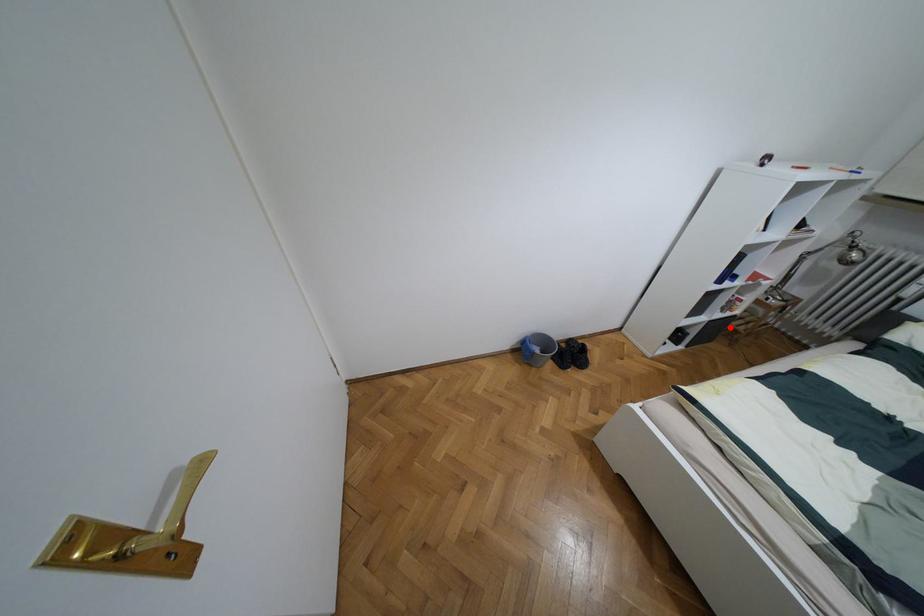
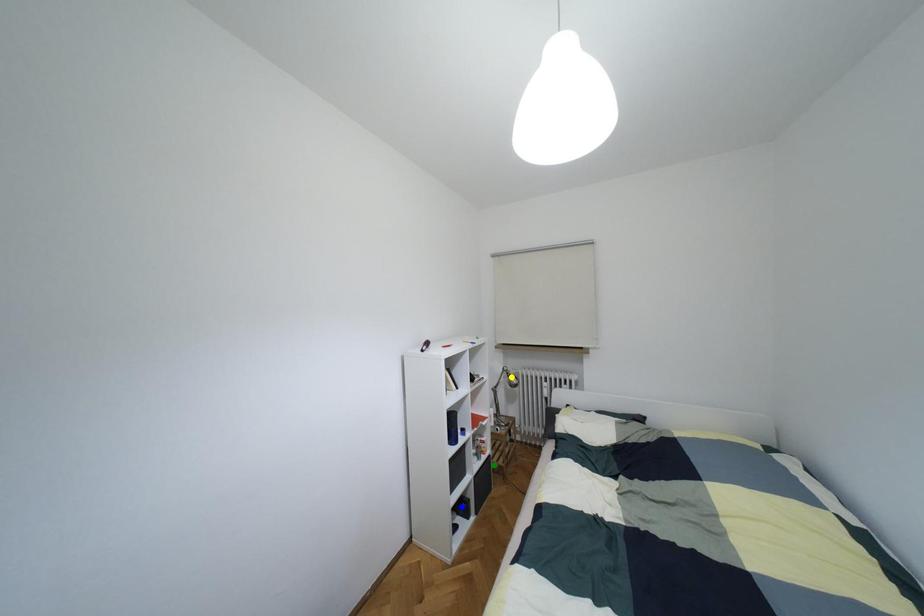
Question: I am providing you with two images of the same scene from different viewpoints. A red point is marked on the first image. You are given multiple points on the second image. Which spot in image 2 lines up with the point in image 1?

Choices:
 (A) blue point
 (B) yellow point
 (C) green point

Answer: (C)